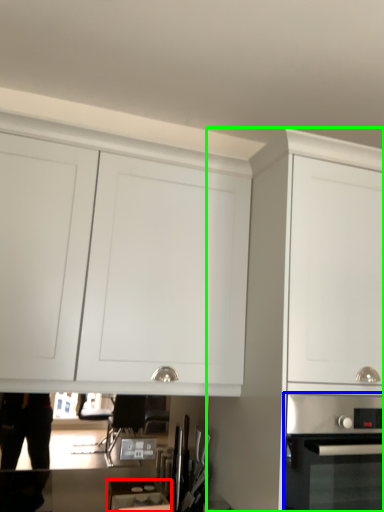
Question: Which object is the closest to the appliance (highlighted by a red box)? Choose among these: home appliance (highlighted by a blue box) or cabinetry (highlighted by a green box).

Choices:
 (A) home appliance
 (B) cabinetry

Answer: (B)